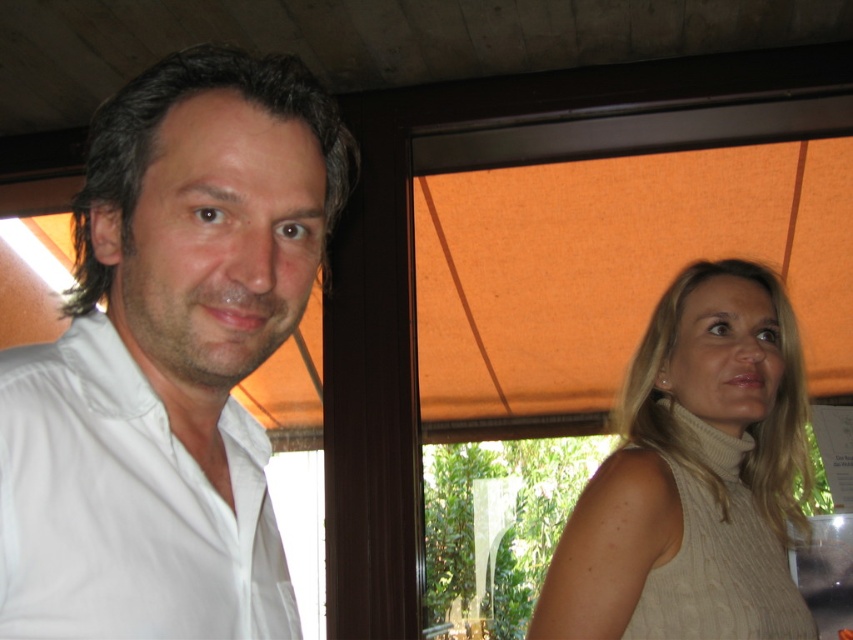
You are a photographer setting up for a portrait shoot. You need to ensure that the white smooth shirt at left and beige knitted sweater at right are both visible in the frame. Given their sizes, which object might require you to adjust your camera angle to include it fully?

The beige knitted sweater at right occupies more space than the white smooth shirt at left, so you might need to adjust your camera angle to ensure the larger beige knitted sweater at right is fully visible in the frame.

You are standing in front of the window with orange blinds and want to locate the white smooth shirt at left. Can you tell me the exact coordinates where it is positioned?

The white smooth shirt at left is positioned at coordinates point (169, 358).